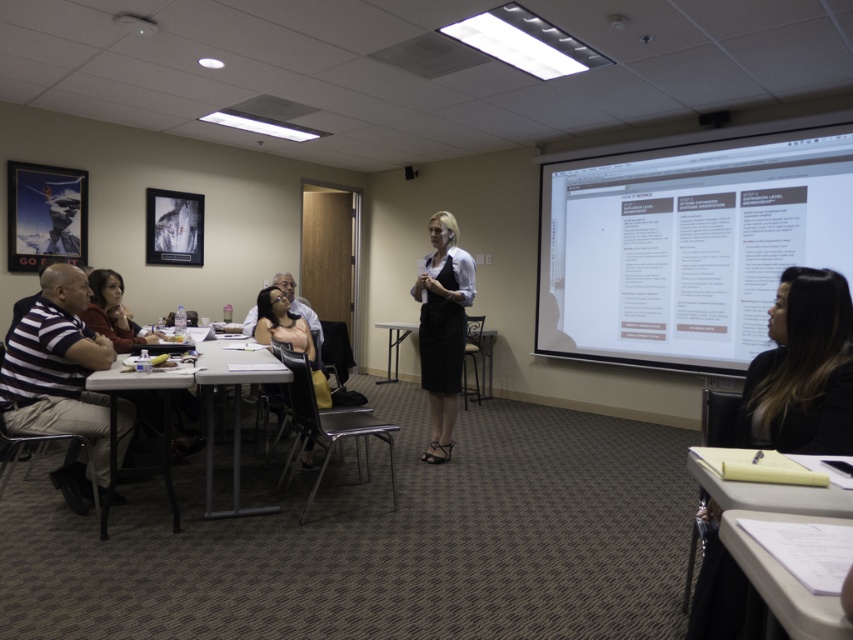
Question: Considering the relative positions of striped fabric shirt at left and black satin skirt at center in the image provided, where is striped fabric shirt at left located with respect to black satin skirt at center?

Choices:
 (A) left
 (B) right

Answer: (A)

Question: Based on their relative distances, which object is nearer to the matte black dress at lower center?

Choices:
 (A) white paper at lower right
 (B) black satin skirt at center

Answer: (B)

Question: Which point is closer to the camera?

Choices:
 (A) pyautogui.click(x=12, y=410)
 (B) pyautogui.click(x=780, y=582)
 (C) pyautogui.click(x=223, y=515)

Answer: (B)

Question: Is the position of white paper at lower right less distant than that of white plastic table at lower left?

Choices:
 (A) yes
 (B) no

Answer: (A)

Question: Can you confirm if white matte projection screen at upper right is positioned to the left of metallic silver table at center?

Choices:
 (A) yes
 (B) no

Answer: (B)

Question: Among these points, which one is farthest from the camera?

Choices:
 (A) (834, 173)
 (B) (74, 298)
 (C) (436, 404)
 (D) (407, 330)

Answer: (D)